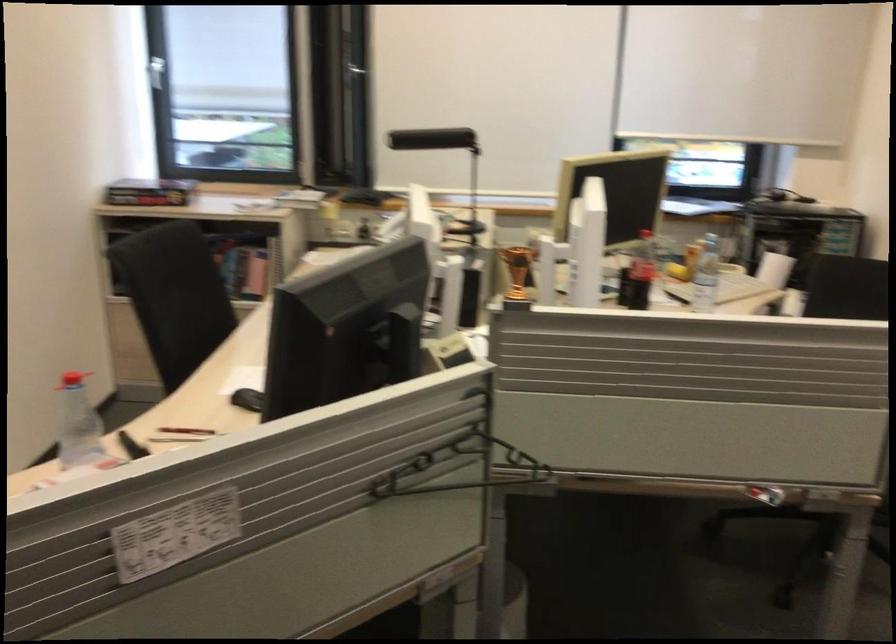
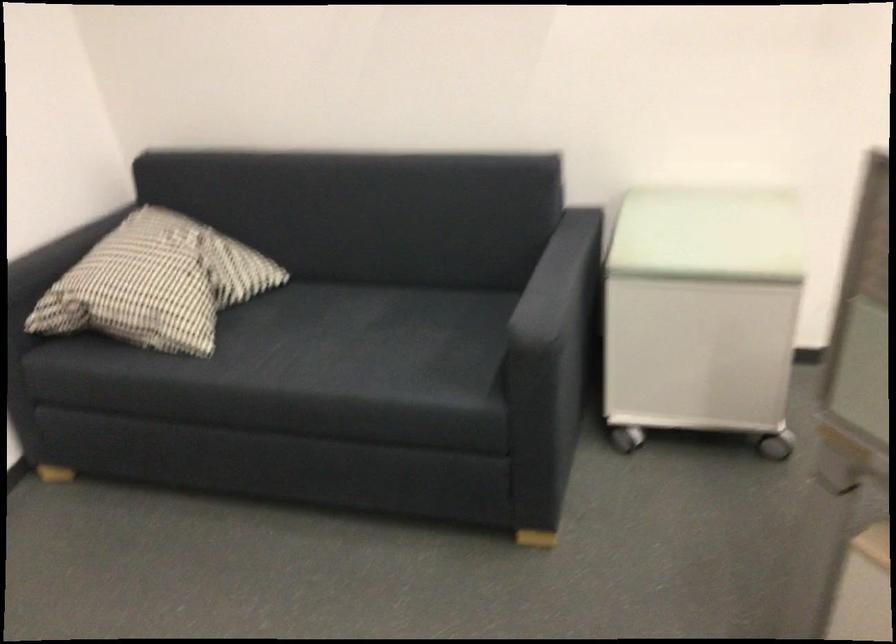
Consider the image. Based on the continuous images, in which direction is the camera rotating?

The camera's rotation is toward left-down.